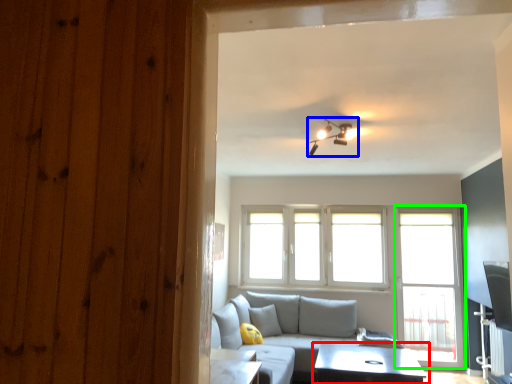
Question: Based on their relative distances, which object is farther from table (highlighted by a red box)? Choose from light fixture (highlighted by a blue box) and screen door (highlighted by a green box).

Choices:
 (A) light fixture
 (B) screen door

Answer: (A)